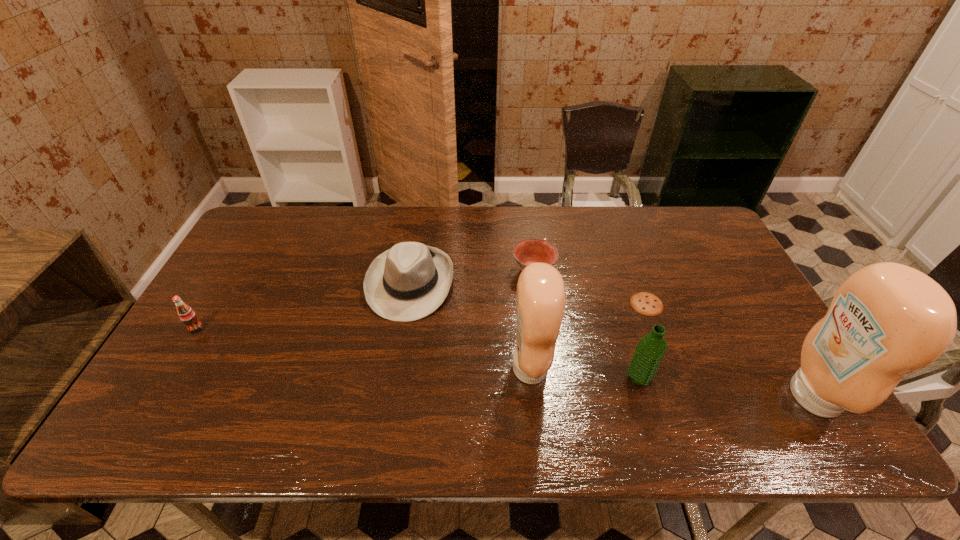
The image size is (960, 540). What are the coordinates of `the sixth shortest object` in the screenshot? It's located at (540, 297).

You are a GUI agent. You are given a task and a screenshot of the screen. Output one action in this format:
    pyautogui.click(x=<x>, y=<y>)
    Task: Click on the shorter condiment
    The height and width of the screenshot is (540, 960).
    Given the screenshot: What is the action you would take?
    pyautogui.click(x=540, y=297)

Locate an element on the screen. The image size is (960, 540). the right condiment is located at coordinates [x=886, y=320].

Where is `the rightmost object`? The image size is (960, 540). the rightmost object is located at coordinates (886, 320).

The image size is (960, 540). Identify the location of the second object from left to right. (409, 281).

The image size is (960, 540). Find the location of `the second object from right to left`. the second object from right to left is located at coordinates (644, 303).

Where is `the shortest object`? This screenshot has width=960, height=540. the shortest object is located at coordinates (644, 303).

Image resolution: width=960 pixels, height=540 pixels. What are the coordinates of `bowl` in the screenshot? It's located at (527, 251).

Locate an element on the screen. Image resolution: width=960 pixels, height=540 pixels. the fourth farthest object is located at coordinates (187, 315).

In order to click on the leftmost object in this screenshot , I will do `click(187, 315)`.